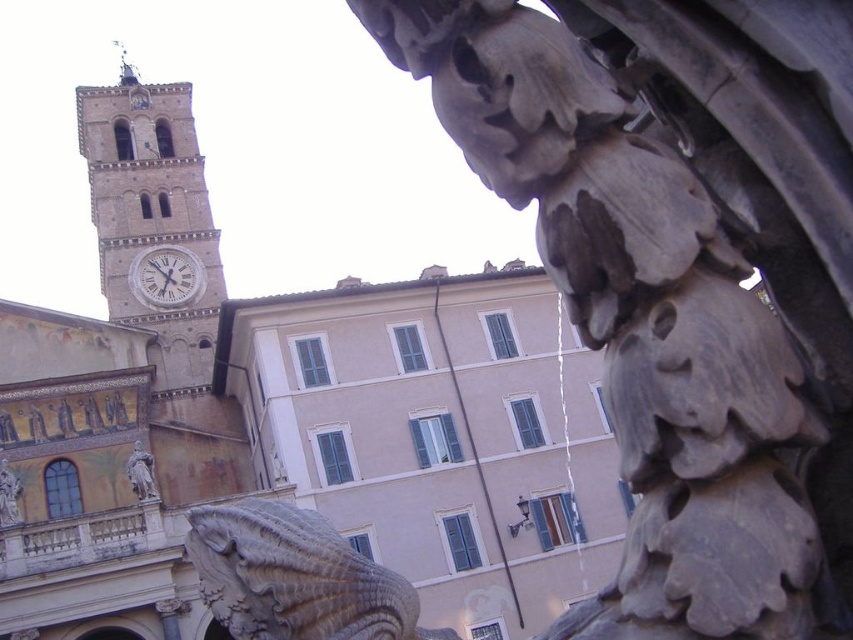
Question: Is gray stone sculpture at center further to camera compared to brown stone clock tower at upper left?

Choices:
 (A) no
 (B) yes

Answer: (A)

Question: In this image, where is carved stone lion at lower left located relative to polished bronze statue at center?

Choices:
 (A) below
 (B) above

Answer: (A)

Question: Is gray stone sculpture at center in front of brown stone clock tower at upper left?

Choices:
 (A) yes
 (B) no

Answer: (A)

Question: Estimate the real-world distances between objects in this image. Which object is closer to the white marble clock at upper left?

Choices:
 (A) gray stone sculpture at center
 (B) polished bronze statue at center
 (C) brown stone clock tower at upper left

Answer: (C)

Question: Which of the following is the closest to the observer?

Choices:
 (A) gray stone sculpture at center
 (B) white marble clock at upper left

Answer: (A)

Question: Among these points, which one is nearest to the camera?

Choices:
 (A) (628, 544)
 (B) (194, 170)

Answer: (A)